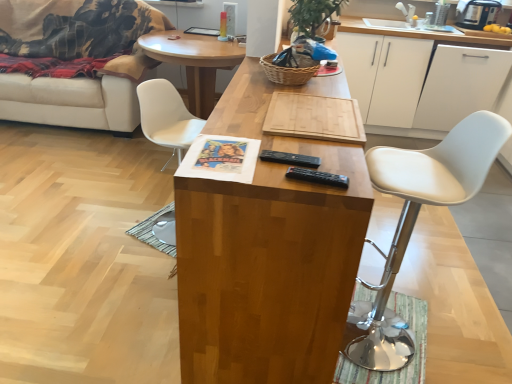
Find the location of a particular element. vacant area that is in front of natural wood cutting board at center is located at coordinates (293, 153).